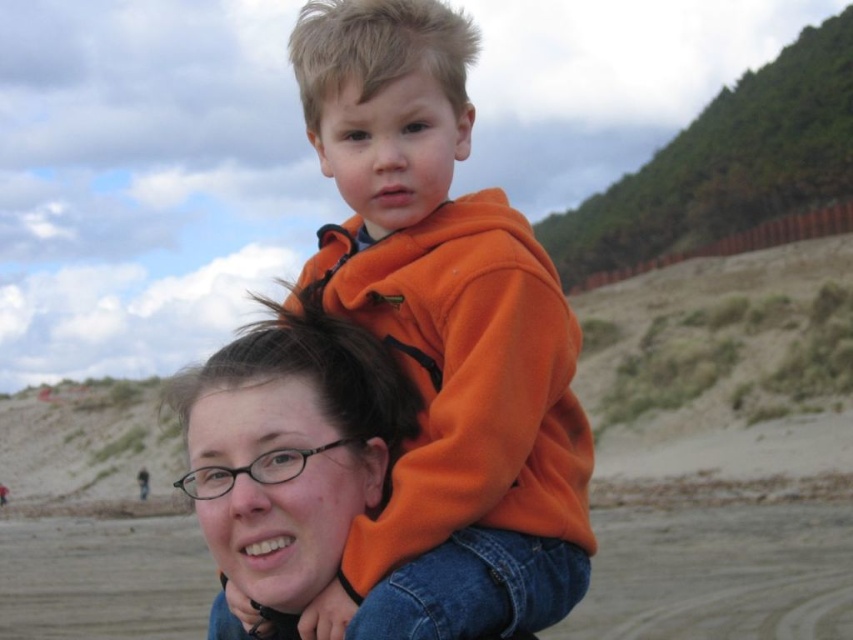
Question: Can you confirm if orange fleece at center is positioned above matte orange hoodie at center?

Choices:
 (A) no
 (B) yes

Answer: (B)

Question: Which object is closer to the camera taking this photo?

Choices:
 (A) matte orange hoodie at center
 (B) orange fleece at center

Answer: (B)

Question: Is orange fleece at center closer to the viewer compared to matte orange hoodie at center?

Choices:
 (A) yes
 (B) no

Answer: (A)

Question: Which of the following is the closest to the observer?

Choices:
 (A) matte orange hoodie at center
 (B) orange fleece at center

Answer: (B)

Question: In this image, where is orange fleece at center located relative to matte orange hoodie at center?

Choices:
 (A) left
 (B) right

Answer: (B)

Question: Which of the following is the closest to the observer?

Choices:
 (A) matte orange hoodie at center
 (B) orange fleece at center

Answer: (B)